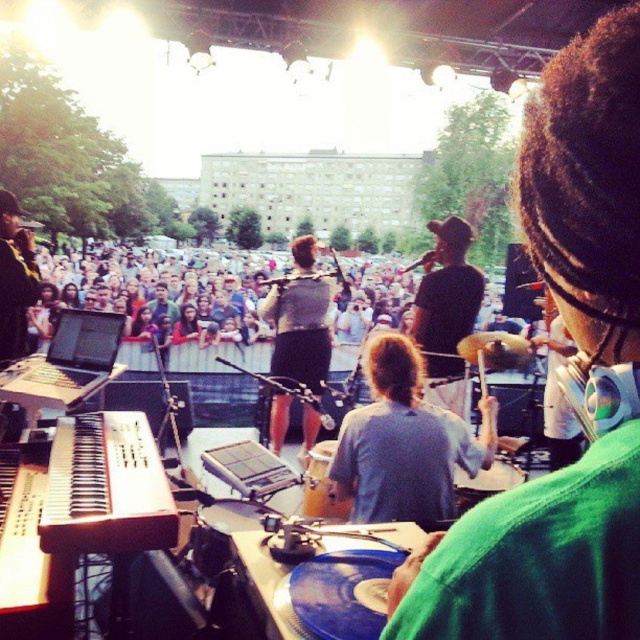
Question: Does gray fabric shirt at center have a smaller size compared to wooden piano at center?

Choices:
 (A) yes
 (B) no

Answer: (B)

Question: Among these points, which one is nearest to the camera?

Choices:
 (A) (486, 445)
 (B) (68, 540)

Answer: (B)

Question: Which point is farther to the camera?

Choices:
 (A) wooden piano at center
 (B) gray fabric shirt at center

Answer: (B)

Question: Is gray fabric shirt at center wider than wooden piano at center?

Choices:
 (A) no
 (B) yes

Answer: (B)

Question: Which of the following is the closest to the observer?

Choices:
 (A) wooden piano at center
 (B) gray fabric shirt at center

Answer: (A)

Question: Considering the relative positions of gray fabric shirt at center and wooden piano at center in the image provided, where is gray fabric shirt at center located with respect to wooden piano at center?

Choices:
 (A) right
 (B) left

Answer: (A)